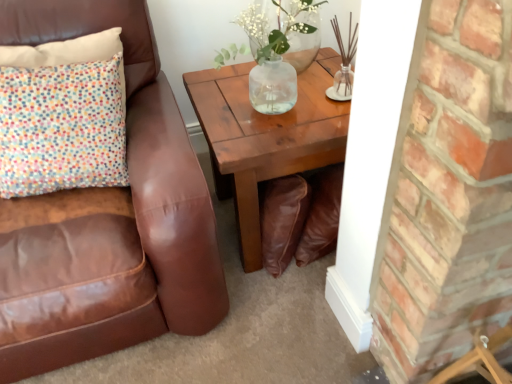
Question: Can you confirm if wooden coffee table at center is bigger than clear glass vase at upper center?

Choices:
 (A) yes
 (B) no

Answer: (A)

Question: From a real-world perspective, is wooden coffee table at center positioned over clear glass vase at upper center based on gravity?

Choices:
 (A) no
 (B) yes

Answer: (A)

Question: Is wooden coffee table at center beside clear glass vase at upper center?

Choices:
 (A) yes
 (B) no

Answer: (B)

Question: Is wooden coffee table at center not close to clear glass vase at upper center?

Choices:
 (A) yes
 (B) no

Answer: (B)

Question: Is wooden coffee table at center positioned with its back to clear glass vase at upper center?

Choices:
 (A) no
 (B) yes

Answer: (A)

Question: Considering the positions of point (104, 248) and point (53, 122), is point (104, 248) closer or farther from the camera than point (53, 122)?

Choices:
 (A) farther
 (B) closer

Answer: (B)

Question: From the image's perspective, is brown leather chair at left above or below multicolored fabric pillow at upper left?

Choices:
 (A) above
 (B) below

Answer: (B)

Question: Is brown leather chair at left to the left or to the right of multicolored fabric pillow at upper left in the image?

Choices:
 (A) left
 (B) right

Answer: (A)

Question: Relative to multicolored fabric pillow at upper left, is brown leather chair at left in front or behind?

Choices:
 (A) behind
 (B) front

Answer: (B)

Question: Is wooden coffee table at center taller or shorter than brown leather chair at left?

Choices:
 (A) tall
 (B) short

Answer: (B)

Question: Relative to brown leather chair at left, is wooden coffee table at center in front or behind?

Choices:
 (A) behind
 (B) front

Answer: (A)

Question: From a real-world perspective, is wooden coffee table at center positioned above or below brown leather chair at left?

Choices:
 (A) below
 (B) above

Answer: (A)

Question: Based on their positions, is wooden coffee table at center located to the left or right of brown leather chair at left?

Choices:
 (A) right
 (B) left

Answer: (A)

Question: From their relative heights in the image, would you say wooden coffee table at center is taller or shorter than clear glass vase at upper center?

Choices:
 (A) short
 (B) tall

Answer: (B)

Question: From a real-world perspective, is wooden coffee table at center above or below clear glass vase at upper center?

Choices:
 (A) above
 (B) below

Answer: (B)